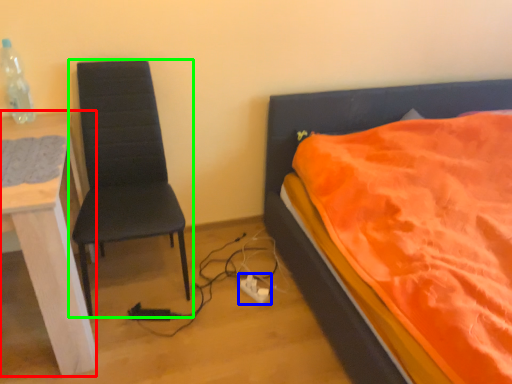
Question: Considering the real-world distances, which object is farthest from desk (highlighted by a red box)? power plugs and sockets (highlighted by a blue box) or chair (highlighted by a green box)?

Choices:
 (A) power plugs and sockets
 (B) chair

Answer: (A)